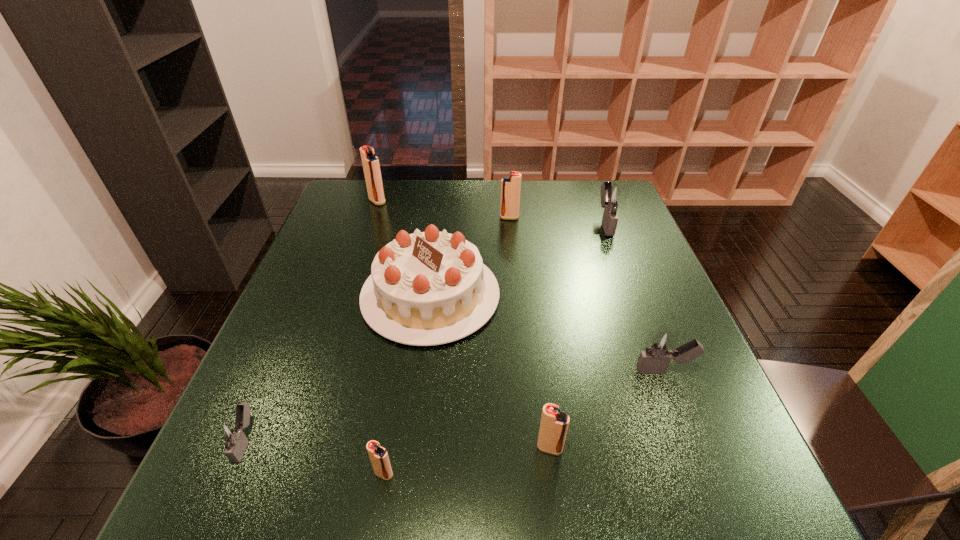
The width and height of the screenshot is (960, 540). What are the coordinates of `blank region between the biggest gray igniter and the third nearest red igniter` in the screenshot? It's located at (557, 220).

The height and width of the screenshot is (540, 960). I want to click on vacant point located between the third biggest red igniter and the leftmost igniter, so click(398, 444).

At what (x,y) coordinates should I click in order to perform the action: click on free space between the leftmost red igniter and the fourth nearest igniter. Please return your answer as a coordinate pair (x, y). This screenshot has height=540, width=960. Looking at the image, I should click on (521, 286).

Image resolution: width=960 pixels, height=540 pixels. I want to click on vacant space in between the second smallest red igniter and the smallest gray igniter, so click(x=398, y=444).

Find the location of a particular element. This screenshot has width=960, height=540. free space between the nearest red igniter and the third nearest red igniter is located at coordinates (446, 346).

I want to click on unoccupied position between the third farthest red igniter and the fourth farthest object, so click(491, 372).

Locate an element on the screen. vacant region between the farthest gray igniter and the leftmost red igniter is located at coordinates (492, 212).

At what (x,y) coordinates should I click in order to perform the action: click on free area in between the third biggest red igniter and the leftmost igniter. Please return your answer as a coordinate pair (x, y). Looking at the image, I should click on (398, 444).

The width and height of the screenshot is (960, 540). I want to click on vacant area that lies between the second farthest red igniter and the nearest igniter, so click(446, 346).

Find the location of a particular element. This screenshot has width=960, height=540. object identified as the seventh closest to the third farthest red igniter is located at coordinates (371, 166).